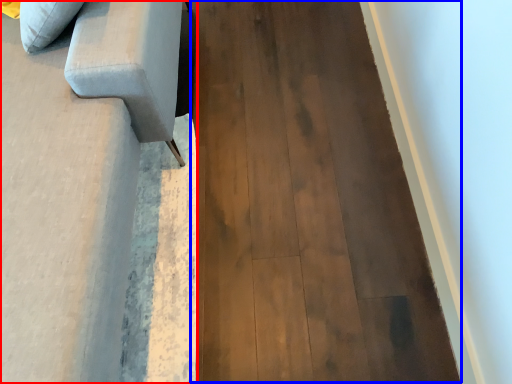
Question: Which of the following is the closest to the observer, furniture (highlighted by a red box) or plywood (highlighted by a blue box)?

Choices:
 (A) furniture
 (B) plywood

Answer: (A)